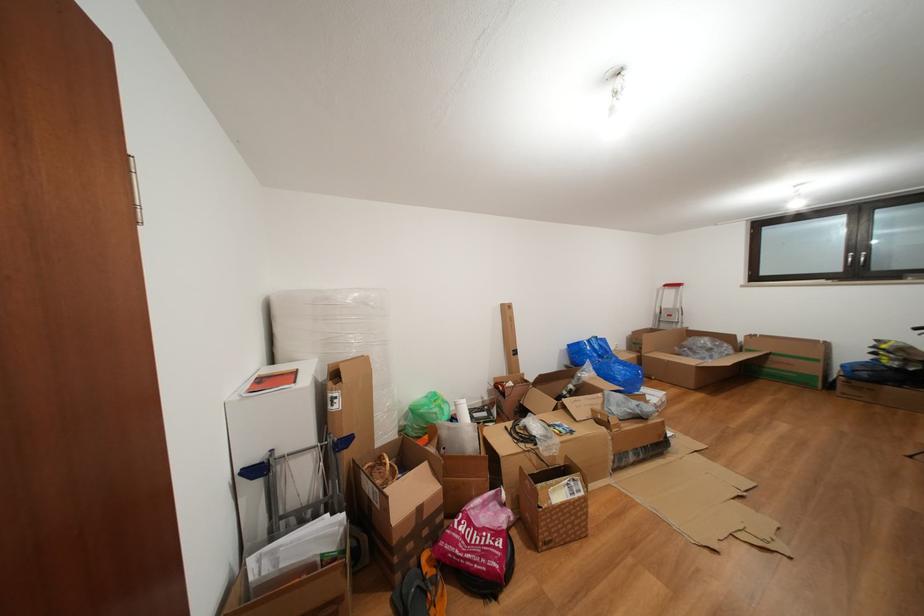
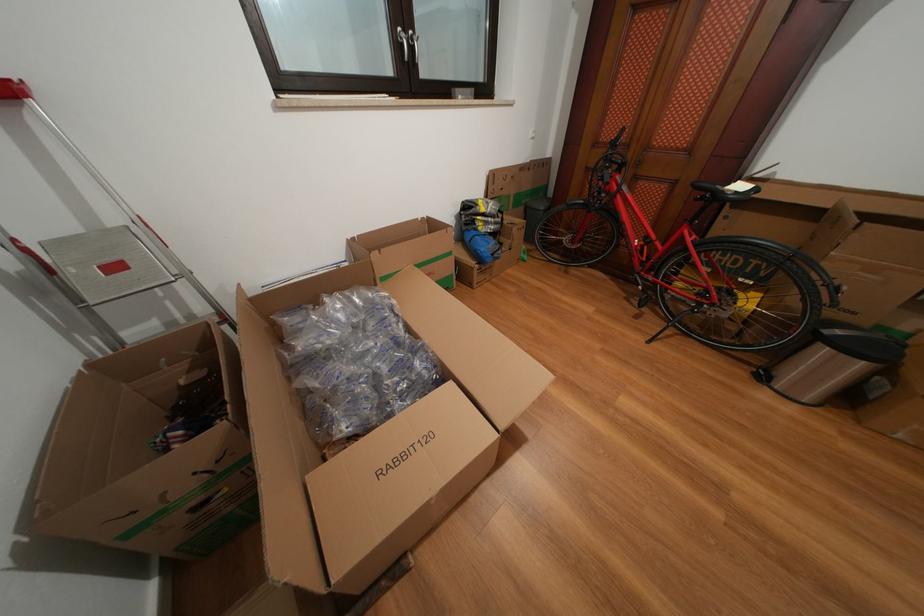
The point at [677,321] is marked in the first image. Where is the corresponding point in the second image?

(124, 273)